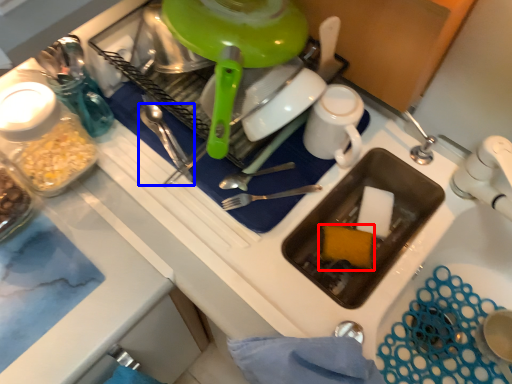
Question: Which point is further to the camera, food (highlighted by a red box) or silverware (highlighted by a blue box)?

Choices:
 (A) food
 (B) silverware

Answer: (A)